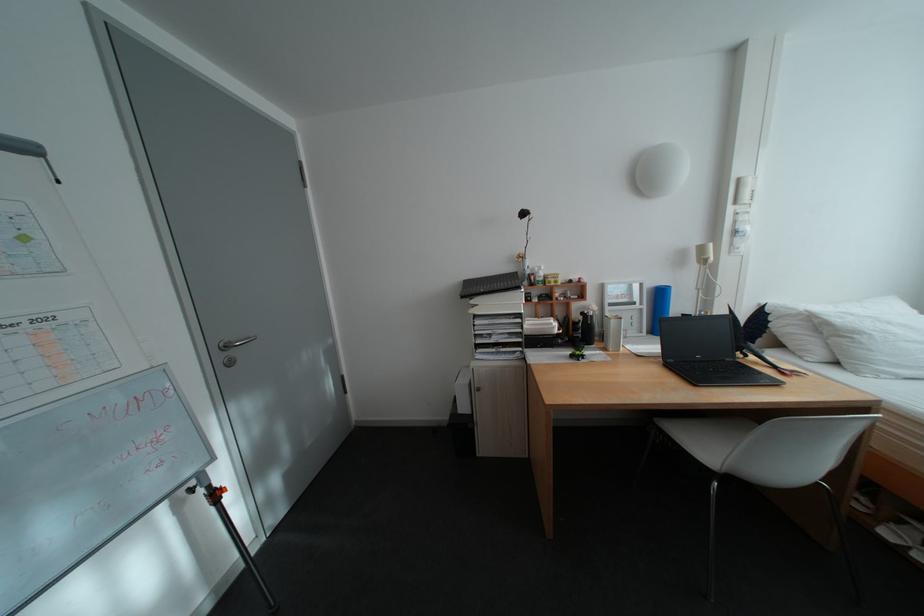
This screenshot has width=924, height=616. Describe the element at coordinates (228, 361) in the screenshot. I see `a wall-mounted button` at that location.